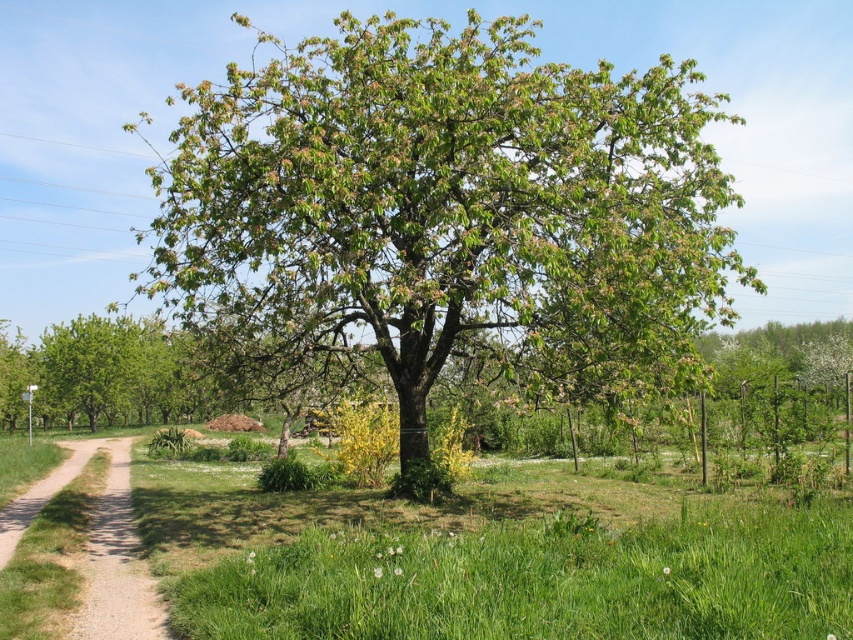
You are planning to plant a new tree in your backyard. You have two options based on the image provided. The first option is the green leafy tree at center, and the second is the green leafy tree at left. If you want a tree that will occupy more space, which one should you choose?

The green leafy tree at center is larger in size than the green leafy tree at left, so you should choose the green leafy tree at center if you want a tree that will occupy more space.

You are standing at the camera position and want to place a small flag at each of the two points, point (570, 536) and point (125, 532). Which point will have its flag appear higher in the image?

Point (570, 536) will have its flag appear higher in the image because it is closer to the camera than point (125, 532).